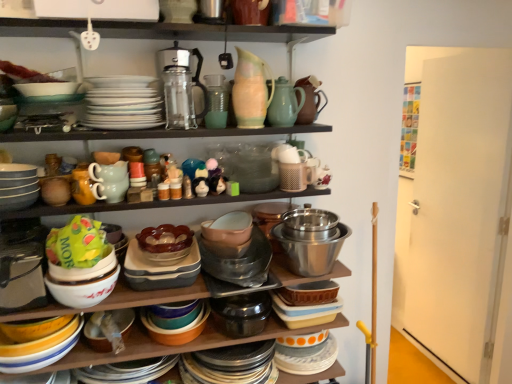
In order to click on matte green teapot at center-left, which ranks as the 3th tableware in top-to-bottom order in this screenshot , I will do `click(109, 181)`.

Image resolution: width=512 pixels, height=384 pixels. What do you see at coordinates (310, 100) in the screenshot?
I see `brown matte teapot at upper center, marked as the third tea pot in a left-to-right arrangement` at bounding box center [310, 100].

What do you see at coordinates (180, 87) in the screenshot? This screenshot has height=384, width=512. I see `transparent glass teapot at center, the 1th tea pot viewed from the left` at bounding box center [180, 87].

Locate an element on the screen. matte green teapot at center-left, which ranks as the 3th tableware in top-to-bottom order is located at coordinates (109, 181).

In terms of width, does green glass vase at upper center, the second tableware viewed from the top, look wider or thinner when compared to transparent glass teapot at center, acting as the third tea pot starting from the right?

A: Clearly, green glass vase at upper center, the second tableware viewed from the top, has less width compared to transparent glass teapot at center, acting as the third tea pot starting from the right.

Is green glass vase at upper center, the second tableware viewed from the top, taller than transparent glass teapot at center, acting as the third tea pot starting from the right?

Incorrect, the height of green glass vase at upper center, the second tableware viewed from the top, is not larger of that of transparent glass teapot at center, acting as the third tea pot starting from the right.

From the picture: From the image's perspective, is green glass vase at upper center, placed as the 2th tableware when sorted from left to right, above transparent glass teapot at center, acting as the third tea pot starting from the right?

Correct, green glass vase at upper center, placed as the 2th tableware when sorted from left to right, appears higher than transparent glass teapot at center, acting as the third tea pot starting from the right, in the image.

Consider the image. From a real-world perspective, is green glass vase at upper center, placed as the 2th tableware when sorted from left to right, positioned above or below transparent glass teapot at center, the 1th tea pot viewed from the left?

In terms of real-world spatial position, green glass vase at upper center, placed as the 2th tableware when sorted from left to right, is below transparent glass teapot at center, the 1th tea pot viewed from the left.

Find the location of a particular element. platter that appears above the translucent glass cups at upper center (from a real-world perspective) is located at coordinates (122, 103).

Is the surface of white glossy platter at upper center, the 2th platter positioned from the bottom, in direct contact with translucent glass cups at upper center?

No.

What's the angular difference between white glossy platter at upper center, the first platter when ordered from top to bottom, and translucent glass cups at upper center's facing directions?

The facing directions of white glossy platter at upper center, the first platter when ordered from top to bottom, and translucent glass cups at upper center are 3.29 degrees apart.

Could you tell me if white glossy platter at upper center, the first platter when ordered from top to bottom, is facing translucent glass cups at upper center?

No, white glossy platter at upper center, the first platter when ordered from top to bottom, is not oriented towards translucent glass cups at upper center.

From a real-world perspective, is white glossy platter at upper center, the 2th platter positioned from the bottom, below brown matte teapot at upper center, marked as the third tea pot in a left-to-right arrangement?

No, from a real-world perspective, white glossy platter at upper center, the 2th platter positioned from the bottom, is not beneath brown matte teapot at upper center, marked as the third tea pot in a left-to-right arrangement.

Which is more to the right, white glossy platter at upper center, the 2th platter positioned from the bottom, or brown matte teapot at upper center, the first tea pot positioned from the right?

From the viewer's perspective, brown matte teapot at upper center, the first tea pot positioned from the right, appears more on the right side.

Relative to brown matte teapot at upper center, marked as the third tea pot in a left-to-right arrangement, is white glossy platter at upper center, the 2th platter positioned from the bottom, in front or behind?

Visually, white glossy platter at upper center, the 2th platter positioned from the bottom, is located in front of brown matte teapot at upper center, marked as the third tea pot in a left-to-right arrangement.

Is point (116, 116) in front of point (318, 96)?

Yes, point (116, 116) is closer to viewer.

From a real-world perspective, is matte green teapot at center-left, which is counted as the 1th tableware, starting from the bottom, above or below green matte bag at center?

In terms of real-world spatial position, matte green teapot at center-left, which is counted as the 1th tableware, starting from the bottom, is above green matte bag at center.

Is the position of matte green teapot at center-left, which ranks as the 1th tableware in left-to-right order, less distant than that of green matte bag at center?

No, the depth of matte green teapot at center-left, which ranks as the 1th tableware in left-to-right order, is greater than that of green matte bag at center.

How far apart are matte green teapot at center-left, which is counted as the 1th tableware, starting from the bottom, and green matte bag at center?

7.60 inches.

Which is farther from the camera, [121,168] or [61,261]?

The point [121,168] is farther.

Is white glossy platter at upper center, the first platter when ordered from top to bottom, taller than green matte bag at center?

Indeed, white glossy platter at upper center, the first platter when ordered from top to bottom, has a greater height compared to green matte bag at center.

Is white glossy platter at upper center, the 2th platter positioned from the bottom, facing away from green matte bag at center?

That's not correct — white glossy platter at upper center, the 2th platter positioned from the bottom, is not looking away from green matte bag at center.

From the image's perspective, would you say white glossy platter at upper center, the first platter when ordered from top to bottom, is shown under green matte bag at center?

No.

From a real-world perspective, is white glossy platter at upper center, the 2th platter positioned from the bottom, beneath green matte bag at center?

No, from a real-world perspective, white glossy platter at upper center, the 2th platter positioned from the bottom, is not below green matte bag at center.

Who is bigger, matte ceramic bowl at center, which is the 1th bowl in left-to-right order, or matte green teapot at center-left, which is counted as the 1th tableware, starting from the bottom?

matte ceramic bowl at center, which is the 1th bowl in left-to-right order.

From the image's perspective, between matte ceramic bowl at center, the 3th bowl from the right, and matte green teapot at center-left, positioned as the 3th tableware in right-to-left order, who is located below?

matte ceramic bowl at center, the 3th bowl from the right.

Is matte ceramic bowl at center, the 3th bowl from the right, positioned beyond the bounds of matte green teapot at center-left, which ranks as the 3th tableware in top-to-bottom order?

Yes.

Can you tell me how much matte ceramic bowl at center, which is the 1th bowl in left-to-right order, and matte green teapot at center-left, which ranks as the 3th tableware in top-to-bottom order, differ in facing direction?

matte ceramic bowl at center, which is the 1th bowl in left-to-right order, and matte green teapot at center-left, which ranks as the 3th tableware in top-to-bottom order, are facing 4.02 degrees away from each other.

From the image's perspective, between white glazed platter at center, which is the 2th platter from top to bottom, and matte plastic containers at center, who is located below?

white glazed platter at center, which is the 2th platter from top to bottom.

From a real-world perspective, is white glazed platter at center, which is the 1th platter from bottom to top, above or below matte plastic containers at center?

white glazed platter at center, which is the 1th platter from bottom to top, is situated lower than matte plastic containers at center in the real world.

Is white glazed platter at center, which is the 2th platter from top to bottom, turned away from matte plastic containers at center?

No, white glazed platter at center, which is the 2th platter from top to bottom, is not facing the opposite direction of matte plastic containers at center.

In the scene shown: Who is bigger, white glazed platter at center, which is the 1th platter from bottom to top, or matte plastic containers at center?

Bigger between the two is white glazed platter at center, which is the 1th platter from bottom to top.

Where is `tea pot on the left of green glass vase at upper center, the second tableware viewed from the top`? The image size is (512, 384). tea pot on the left of green glass vase at upper center, the second tableware viewed from the top is located at coordinates (180, 87).

The image size is (512, 384). What are the coordinates of `shelf located below the white glossy platter at upper center, the first platter when ordered from top to bottom (from the image's perspective)` in the screenshot? It's located at (154, 203).

Looking at the image, which one is located further to matte ceramic bowl at center, which is the 1th bowl in left-to-right order, shiny metallic bowls at center, which ranks as the first bowl in right-to-left order, or green matte bag at center?

shiny metallic bowls at center, which ranks as the first bowl in right-to-left order, is further to matte ceramic bowl at center, which is the 1th bowl in left-to-right order.

Looking at the image, which one is located further to green matte bag at center, matte green teapot at center-left, which is counted as the 1th tableware, starting from the bottom, or matte ceramic bowl at center, the 3th bowl from the right?

Among the two, matte green teapot at center-left, which is counted as the 1th tableware, starting from the bottom, is located further to green matte bag at center.

Considering their positions, is matte plastic containers at center positioned further to green matte bag at center than green glass vase at upper center, the second tableware viewed from the top?

green glass vase at upper center, the second tableware viewed from the top, is further to green matte bag at center.

Based on their spatial positions, is matte ceramic bowl at center, the 3th bowl from the right, or translucent glass cups at upper center closer to green matte bag at center?

matte ceramic bowl at center, the 3th bowl from the right.

Based on their spatial positions, is matte green teapot at center-left, which ranks as the 1th tableware in left-to-right order, or matte plastic containers at center further from white glossy platter at upper center, the first platter when ordered from top to bottom?

matte plastic containers at center.

Considering their positions, is matte ceramic bowl at center, which is the 1th bowl in left-to-right order, positioned closer to green matte bag at center than brown matte teapot at upper center, marked as the third tea pot in a left-to-right arrangement?

The object closer to green matte bag at center is matte ceramic bowl at center, which is the 1th bowl in left-to-right order.

From the image, which object appears to be farther from matte ceramic bowl at center, which is the 1th bowl in left-to-right order, matte ceramic vase at upper center, which appears as the first tableware when viewed from the right, or matte plastic containers at center?

matte ceramic vase at upper center, which appears as the first tableware when viewed from the right, is further to matte ceramic bowl at center, which is the 1th bowl in left-to-right order.

From the picture: Looking at the image, which one is located further to translucent glass cups at upper center, translucent amber bowl at center, marked as the 2th bowl in a right-to-left arrangement, or shiny metallic bowls at center, marked as the 3th bowl in a left-to-right arrangement?

shiny metallic bowls at center, marked as the 3th bowl in a left-to-right arrangement, lies further to translucent glass cups at upper center than the other object.

You are a GUI agent. You are given a task and a screenshot of the screen. Output one action in this format:
    pyautogui.click(x=<x>, y=<y>)
    Task: Click on the platter between green glass vase at upper center, which ranks as the 2th tableware in bottom-to-top order, and matte ceramic bowl at center, which is the 1th bowl in left-to-right order, in the vertical direction
    The height and width of the screenshot is (384, 512).
    Given the screenshot: What is the action you would take?
    pyautogui.click(x=122, y=103)

This screenshot has width=512, height=384. Identify the location of shelf that lies between matte ceramic vase at upper center, acting as the 3th tableware starting from the left, and matte plastic containers at center from top to bottom. (154, 203).

Identify the location of shelf between green matte bag at center and matte ceramic teapot at upper center, which appears as the second tea pot when viewed from the left. (154, 203).

Image resolution: width=512 pixels, height=384 pixels. Identify the location of food between matte ceramic bowl at center, the 3th bowl from the right, and translucent amber bowl at center, placed as the second bowl when sorted from left to right, from left to right. (76, 243).